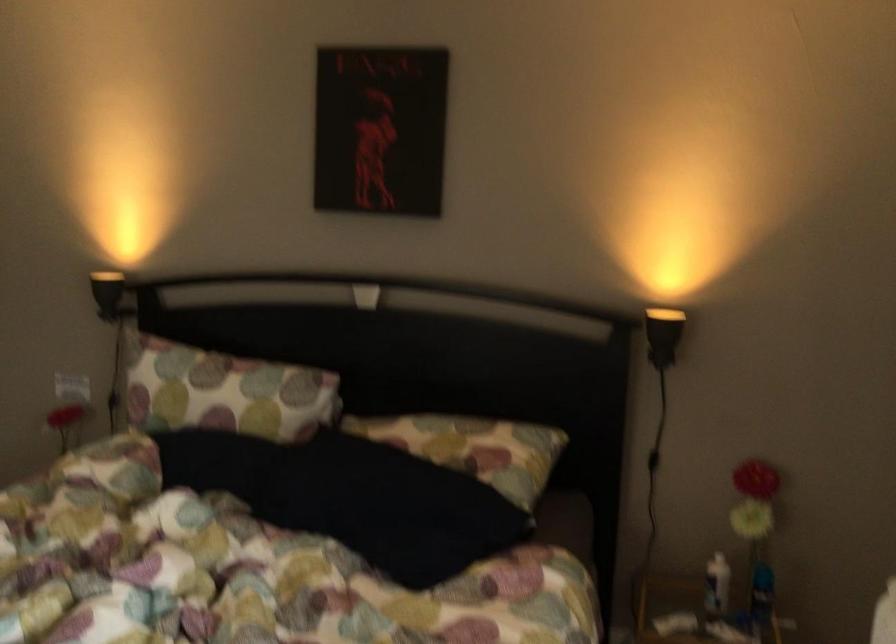
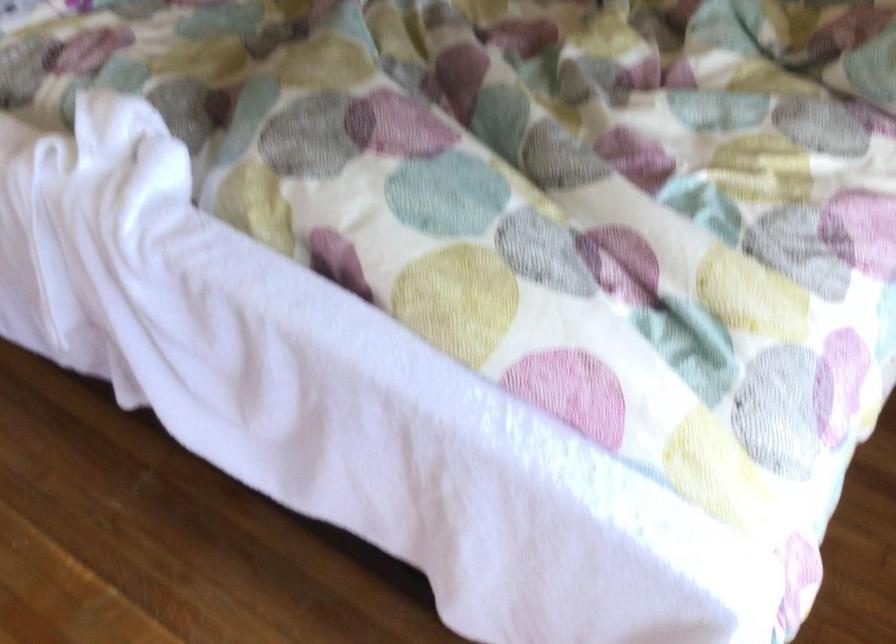
The images are taken continuously from a first-person perspective. In which direction is your viewpoint rotating?

The camera's rotation is toward left-down.